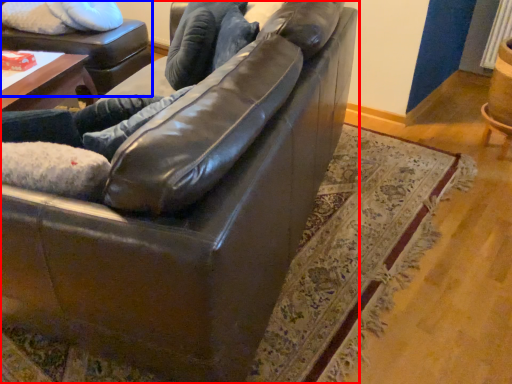
Question: Which object is further to the camera taking this photo, studio couch (highlighted by a red box) or swivel chair (highlighted by a blue box)?

Choices:
 (A) studio couch
 (B) swivel chair

Answer: (B)